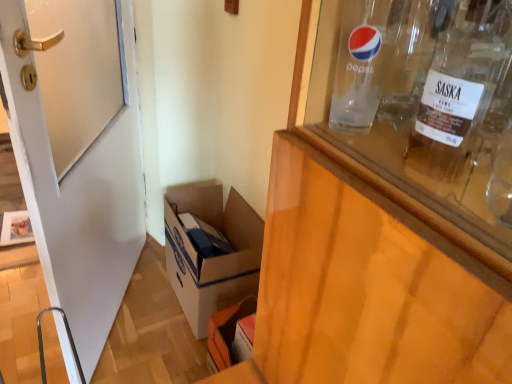
What do you see at coordinates (211, 257) in the screenshot? I see `white cardboard box at lower left` at bounding box center [211, 257].

This screenshot has height=384, width=512. What do you see at coordinates (460, 88) in the screenshot?
I see `transparent glass bottle at upper right` at bounding box center [460, 88].

Image resolution: width=512 pixels, height=384 pixels. Identify the location of white glossy door at left. (77, 152).

The image size is (512, 384). Identify the location of white cardboard box at lower left. (211, 257).

Is white glossy door at left beside white cardboard box at lower left?

No, white glossy door at left is not with white cardboard box at lower left.

From the image's perspective, would you say white glossy door at left is positioned over white cardboard box at lower left?

Correct, white glossy door at left appears higher than white cardboard box at lower left in the image.

Does white glossy door at left have a larger size compared to white cardboard box at lower left?

Yes.

Does white cardboard box at lower left have a lesser width compared to clear glass bottle at upper right?

Incorrect, the width of white cardboard box at lower left is not less than that of clear glass bottle at upper right.

Where is `box that appears below the clear glass bottle at upper right (from the image's perspective)`? box that appears below the clear glass bottle at upper right (from the image's perspective) is located at coordinates (x=211, y=257).

Which is more to the right, white cardboard box at lower left or clear glass bottle at upper right?

clear glass bottle at upper right is more to the right.

Can you confirm if white cardboard box at lower left is smaller than clear glass bottle at upper right?

No.

From the image's perspective, who appears lower, clear glass bottle at upper right or transparent glass bottle at upper right?

From the image's view, transparent glass bottle at upper right is below.

Considering the points (371, 47) and (456, 67), which point is in front, point (371, 47) or point (456, 67)?

Positioned in front is point (456, 67).

The width and height of the screenshot is (512, 384). I want to click on bottle that appears on the right of clear glass bottle at upper right, so click(x=460, y=88).

Which of these two, clear glass bottle at upper right or transparent glass bottle at upper right, is bigger?

clear glass bottle at upper right is bigger.

Is white cardboard box at lower left to the left of white glossy door at left from the viewer's perspective?

No, white cardboard box at lower left is not to the left of white glossy door at left.

In terms of height, does white cardboard box at lower left look taller or shorter compared to white glossy door at left?

white cardboard box at lower left is shorter than white glossy door at left.

How much distance is there between white cardboard box at lower left and white glossy door at left?

14.89 inches.

Is clear glass bottle at upper right not near white cardboard box at lower left?

No, there isn't a large distance between clear glass bottle at upper right and white cardboard box at lower left.

Considering the relative sizes of clear glass bottle at upper right and white cardboard box at lower left in the image provided, is clear glass bottle at upper right bigger than white cardboard box at lower left?

Incorrect, clear glass bottle at upper right is not larger than white cardboard box at lower left.

The height and width of the screenshot is (384, 512). Find the location of `glass bottle in front of the white cardboard box at lower left`. glass bottle in front of the white cardboard box at lower left is located at coordinates (364, 60).

In the image, is clear glass bottle at upper right on the left side or the right side of white cardboard box at lower left?

clear glass bottle at upper right is to the right of white cardboard box at lower left.

Between white cardboard box at lower left and transparent glass bottle at upper right, which one appears on the right side from the viewer's perspective?

transparent glass bottle at upper right.

Is transparent glass bottle at upper right inside white cardboard box at lower left?

Definitely not — transparent glass bottle at upper right is not inside white cardboard box at lower left.

This screenshot has height=384, width=512. I want to click on bottle located on the right of white cardboard box at lower left, so click(460, 88).

From a real-world perspective, does white cardboard box at lower left stand above transparent glass bottle at upper right?

No, from a real-world perspective, white cardboard box at lower left is not above transparent glass bottle at upper right.

From the image's perspective, is white glossy door at left below clear glass bottle at upper right?

Yes.

From the picture: Is white glossy door at left positioned with its back to clear glass bottle at upper right?

Yes, clear glass bottle at upper right is at the back of white glossy door at left.

Is point (93, 39) positioned in front of point (392, 34)?

No, (93, 39) is further to viewer.

Looking at this image, measure the distance between white glossy door at left and clear glass bottle at upper right.

They are 32.68 inches apart.

In order to click on box below the white glossy door at left (from a real-world perspective) in this screenshot , I will do `click(211, 257)`.

Find the location of a particular element. The width and height of the screenshot is (512, 384). box on the left of clear glass bottle at upper right is located at coordinates (211, 257).

From the image, which object appears to be nearer to white glossy door at left, white cardboard box at lower left or clear glass bottle at upper right?

The object closer to white glossy door at left is white cardboard box at lower left.

Considering their positions, is white glossy door at left positioned closer to transparent glass bottle at upper right than clear glass bottle at upper right?

clear glass bottle at upper right.

From the image, which object appears to be nearer to white glossy door at left, clear glass bottle at upper right or white cardboard box at lower left?

The object closer to white glossy door at left is white cardboard box at lower left.

Which object lies nearer to the anchor point white glossy door at left, white cardboard box at lower left or transparent glass bottle at upper right?

white cardboard box at lower left is positioned closer to the anchor white glossy door at left.

Which object lies further to the anchor point white cardboard box at lower left, transparent glass bottle at upper right or white glossy door at left?

Among the two, transparent glass bottle at upper right is located further to white cardboard box at lower left.

Consider the image. Estimate the real-world distances between objects in this image. Which object is further from clear glass bottle at upper right, transparent glass bottle at upper right or white cardboard box at lower left?

white cardboard box at lower left is further to clear glass bottle at upper right.

From the image, which object appears to be nearer to white cardboard box at lower left, clear glass bottle at upper right or white glossy door at left?

Among the two, white glossy door at left is located nearer to white cardboard box at lower left.

From the image, which object appears to be nearer to transparent glass bottle at upper right, white cardboard box at lower left or clear glass bottle at upper right?

clear glass bottle at upper right is positioned closer to the anchor transparent glass bottle at upper right.

You are a GUI agent. You are given a task and a screenshot of the screen. Output one action in this format:
    pyautogui.click(x=<x>, y=<y>)
    Task: Click on the glass bottle between transparent glass bottle at upper right and white cardboard box at lower left from front to back
    The height and width of the screenshot is (384, 512).
    Given the screenshot: What is the action you would take?
    pyautogui.click(x=364, y=60)

Find the location of a particular element. The height and width of the screenshot is (384, 512). door between transparent glass bottle at upper right and white cardboard box at lower left in the front-back direction is located at coordinates (77, 152).

Locate an element on the screen. The image size is (512, 384). door between clear glass bottle at upper right and white cardboard box at lower left from front to back is located at coordinates (77, 152).

What are the coordinates of `glass bottle between white glossy door at left and transparent glass bottle at upper right` in the screenshot? It's located at (364, 60).